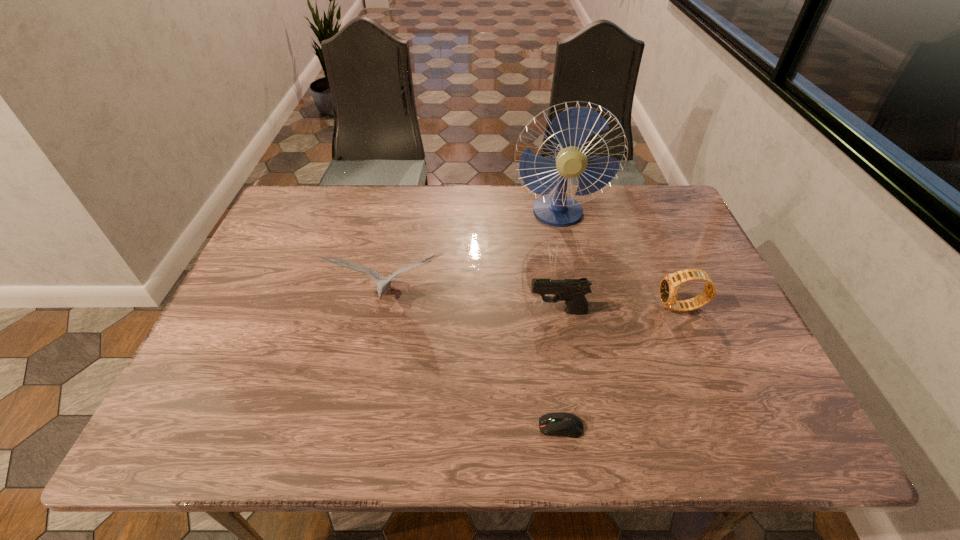
Find the location of `the tallest object`. the tallest object is located at coordinates (571, 128).

Find the location of a particular element. The height and width of the screenshot is (540, 960). fan is located at coordinates [x=571, y=128].

Where is `the leftmost object`? the leftmost object is located at coordinates (383, 283).

Image resolution: width=960 pixels, height=540 pixels. I want to click on gull, so click(x=383, y=283).

This screenshot has height=540, width=960. Find the location of `watch`. watch is located at coordinates (669, 285).

Image resolution: width=960 pixels, height=540 pixels. Find the location of `pistol`. pistol is located at coordinates (572, 291).

What are the coordinates of `the nearest object` in the screenshot? It's located at (566, 424).

The height and width of the screenshot is (540, 960). In order to click on computer equipment in this screenshot , I will do pos(566,424).

Where is `vacant space positioned at the front of the tallest object where the blades are visible`? The height and width of the screenshot is (540, 960). vacant space positioned at the front of the tallest object where the blades are visible is located at coordinates (565, 248).

The height and width of the screenshot is (540, 960). I want to click on free point located at the tip of the beak of the leftmost object, so click(362, 427).